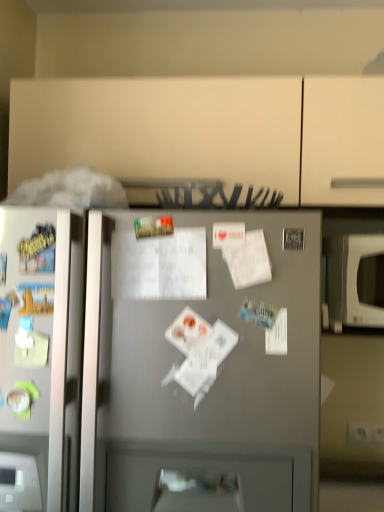
The height and width of the screenshot is (512, 384). What do you see at coordinates (249, 261) in the screenshot?
I see `white matte paper at center` at bounding box center [249, 261].

Where is `white glossy microwave at right`? Image resolution: width=384 pixels, height=512 pixels. white glossy microwave at right is located at coordinates (355, 281).

Locate an element on the screen. white matte paper at center is located at coordinates (249, 261).

Based on the photo, between white glossy microwave at right and satin silver refrigerator at center, which one has more height?

satin silver refrigerator at center is taller.

Can we say white glossy microwave at right lies outside satin silver refrigerator at center?

Yes.

From a real-world perspective, who is located higher, white glossy microwave at right or satin silver refrigerator at center?

white glossy microwave at right.

Is white glossy microwave at right looking in the opposite direction of satin silver refrigerator at center?

white glossy microwave at right does not have its back to satin silver refrigerator at center.

From the image's perspective, which is above, white matte paper at center or satin silver refrigerator at center?

white matte paper at center, from the image's perspective.

Looking at this image, from a real-world perspective, is white matte paper at center positioned above or below satin silver refrigerator at center?

white matte paper at center is situated higher than satin silver refrigerator at center in the real world.

Is white matte paper at center aimed at satin silver refrigerator at center?

Yes, white matte paper at center is aimed at satin silver refrigerator at center.

Identify the location of paper that is above the satin silver refrigerator at center (from the image's perspective). (249, 261).

Is white matte paper at center spatially inside white glossy microwave at right, or outside of it?

white matte paper at center is not inside white glossy microwave at right, it's outside.

Considering the sizes of objects white matte paper at center and white glossy microwave at right in the image provided, who is bigger, white matte paper at center or white glossy microwave at right?

With larger size is white glossy microwave at right.

Between point (249, 237) and point (381, 295), which one is positioned behind?

The point (381, 295) is behind.

Would you say white matte paper at center is part of white glossy microwave at right's contents?

No.

From the picture: From a real-world perspective, is white glossy microwave at right on white matte paper at center?

No, from a real-world perspective, white glossy microwave at right is not on top of white matte paper at center.

In the scene shown: Is white glossy microwave at right beside white matte paper at center?

There is a gap between white glossy microwave at right and white matte paper at center.

Is point (372, 254) more distant than point (261, 266)?

Yes, point (372, 254) is farther from viewer.

Does satin silver refrigerator at center have a greater width compared to white matte paper at center?

Yes.

Which object is further away from the camera taking this photo, satin silver refrigerator at center or white matte paper at center?

white matte paper at center.

Are satin silver refrigerator at center and white matte paper at center located far from each other?

No.

Does point (207, 487) come behind point (234, 250)?

No, it is in front of (234, 250).

Where is `microwave oven above the satin silver refrigerator at center (from a real-world perspective)`? Image resolution: width=384 pixels, height=512 pixels. microwave oven above the satin silver refrigerator at center (from a real-world perspective) is located at coordinates (355, 281).

Considering the relative sizes of satin silver refrigerator at center and white glossy microwave at right in the image provided, is satin silver refrigerator at center wider than white glossy microwave at right?

Yes.

Consider the image. Can you tell me how much satin silver refrigerator at center and white glossy microwave at right differ in facing direction?

4.57 degrees.

Is satin silver refrigerator at center next to white glossy microwave at right and touching it?

No, satin silver refrigerator at center is not making contact with white glossy microwave at right.

Find the location of a particular element. This screenshot has height=512, width=384. microwave oven that is on the right side of satin silver refrigerator at center is located at coordinates (355, 281).

Locate an element on the screen. refrigerator located on the left of white matte paper at center is located at coordinates (202, 374).

Based on their spatial positions, is white matte paper at center or satin silver refrigerator at center further from white glossy microwave at right?

Among the two, satin silver refrigerator at center is located further to white glossy microwave at right.

When comparing their distances from white matte paper at center, does satin silver refrigerator at center or white glossy microwave at right seem further?

white glossy microwave at right is further to white matte paper at center.

Looking at the image, which one is located further to satin silver refrigerator at center, white matte paper at center or white glossy microwave at right?

white glossy microwave at right is positioned further to the anchor satin silver refrigerator at center.

From the image, which object appears to be farther from white matte paper at center, white glossy microwave at right or satin silver refrigerator at center?

The object further to white matte paper at center is white glossy microwave at right.

Estimate the real-world distances between objects in this image. Which object is further from satin silver refrigerator at center, white glossy microwave at right or white matte paper at center?

white glossy microwave at right is positioned further to the anchor satin silver refrigerator at center.

Estimate the real-world distances between objects in this image. Which object is closer to white glossy microwave at right, satin silver refrigerator at center or white matte paper at center?

white matte paper at center.

Find the location of a particular element. This screenshot has height=512, width=384. paper between satin silver refrigerator at center and white glossy microwave at right from left to right is located at coordinates (249, 261).